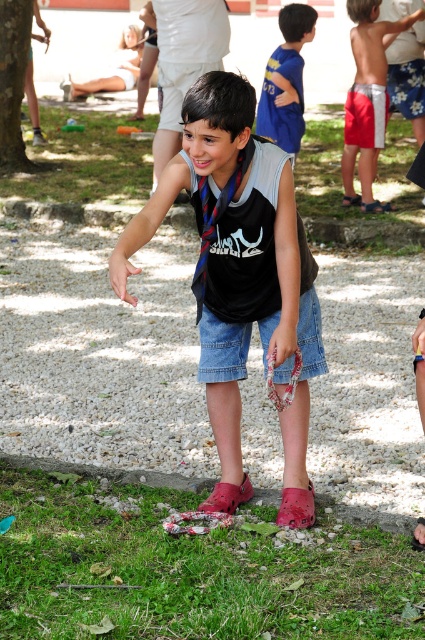
In the scene shown: Is pink croc sandal at lower center taller than brown leather sandal at center?

Incorrect, pink croc sandal at lower center's height is not larger of brown leather sandal at center's.

Who is taller, pink croc sandal at lower center or brown leather sandal at center?

With more height is brown leather sandal at center.

The height and width of the screenshot is (640, 425). What do you see at coordinates (226, 497) in the screenshot?
I see `pink croc sandal at lower center` at bounding box center [226, 497].

Identify the location of pink croc sandal at lower center. (226, 497).

Does reddish-brown leather sandal at lower center have a larger size compared to brown leather sandal at center?

Incorrect, reddish-brown leather sandal at lower center is not larger than brown leather sandal at center.

Is reddish-brown leather sandal at lower center above brown leather sandal at center?

No, reddish-brown leather sandal at lower center is not above brown leather sandal at center.

Describe the element at coordinates (419, 534) in the screenshot. This screenshot has height=640, width=425. I see `reddish-brown leather sandal at lower center` at that location.

Find the location of a particular element. The width and height of the screenshot is (425, 640). reddish-brown leather sandal at lower center is located at coordinates (419, 534).

Can you confirm if blue jersey at upper center is positioned below floral fabric sandal at lower center?

Incorrect, blue jersey at upper center is not positioned below floral fabric sandal at lower center.

Who is more distant from viewer, (285, 77) or (282, 499)?

The point (285, 77) is behind.

Where is `blue jersey at upper center`? The height and width of the screenshot is (640, 425). blue jersey at upper center is located at coordinates (286, 81).